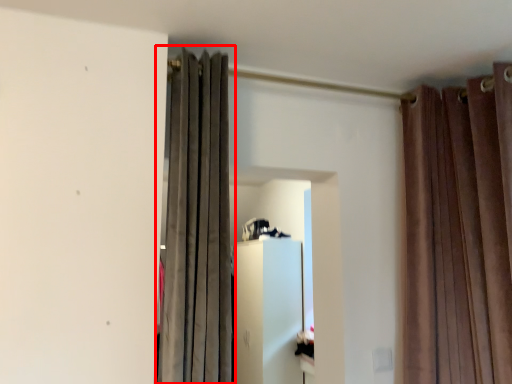
Question: From the image's perspective, considering the relative positions of curtain (annotated by the red box) and curtain in the image provided, where is curtain (annotated by the red box) located with respect to the staircase?

Choices:
 (A) below
 (B) above

Answer: (B)